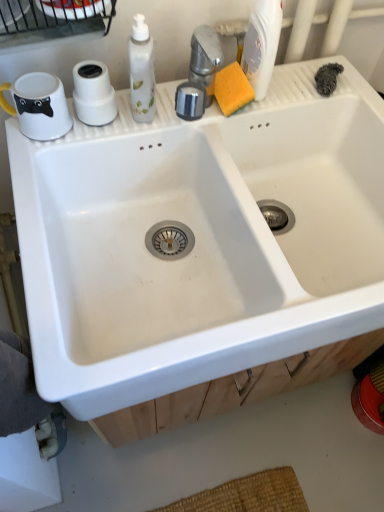
In order to click on space that is in front of white matte toilet paper at upper left in this screenshot , I will do point(66,148).